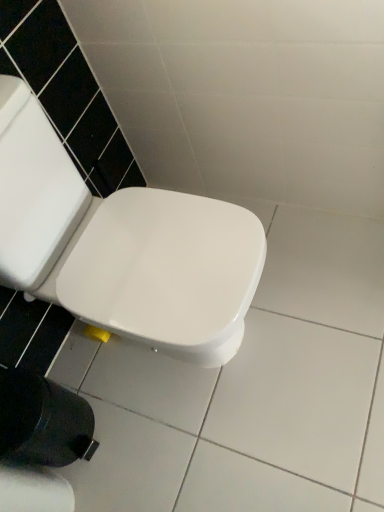
I want to click on vacant area that is situated to the right of white glossy toilet seat at center, so click(314, 276).